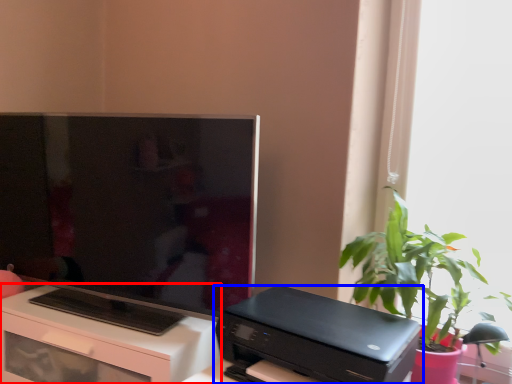
Question: Which of the following is the closest to the observer, desk (highlighted by a red box) or printer (highlighted by a blue box)?

Choices:
 (A) desk
 (B) printer

Answer: (B)